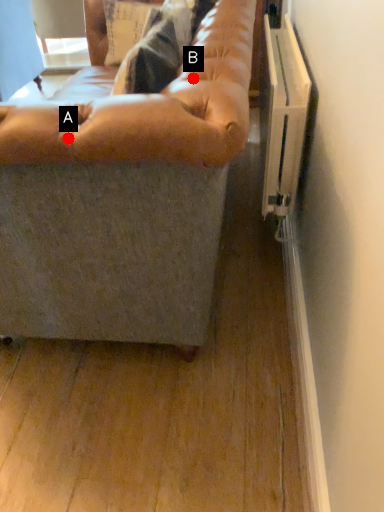
Question: Two points are circled on the image, labeled by A and B beside each circle. Which point is farther to the camera?

Choices:
 (A) A is further
 (B) B is further

Answer: (B)